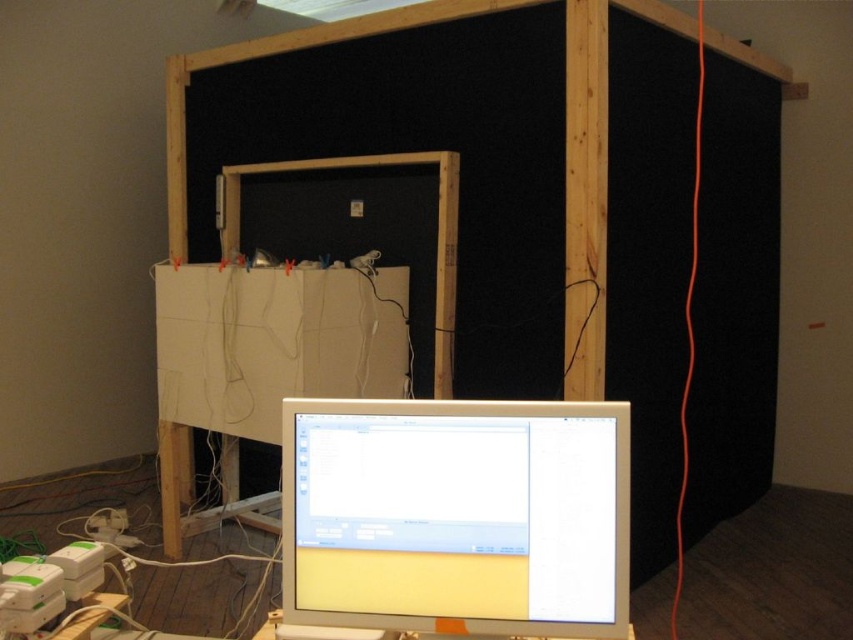
Is white glossy monitor at center positioned at the back of white cardboard at center?

No.

Which is above, white glossy monitor at center or white cardboard at center?

white glossy monitor at center is above.

This screenshot has width=853, height=640. What are the coordinates of `white glossy monitor at center` in the screenshot? It's located at (456, 515).

Find the location of a particular element. This screenshot has width=853, height=640. white glossy monitor at center is located at coordinates (456, 515).